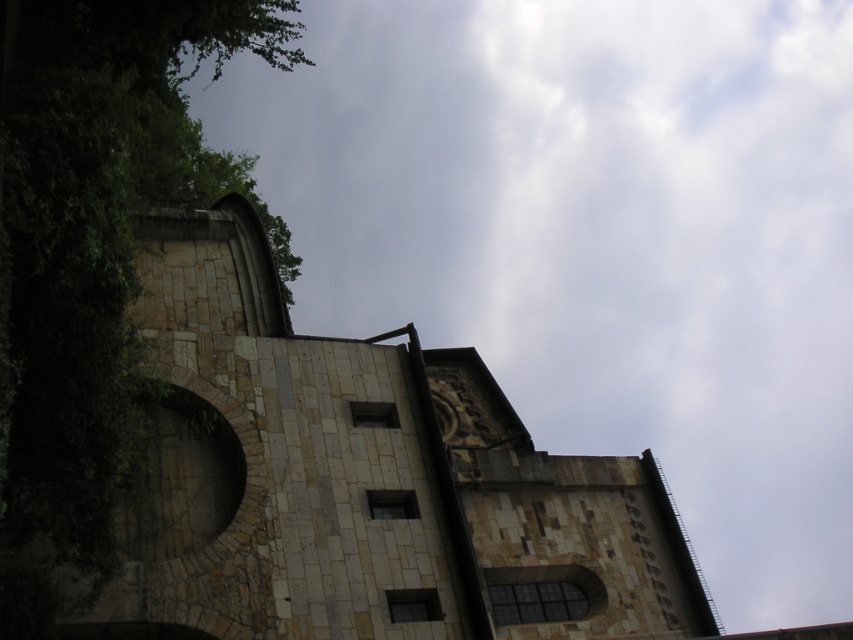
Identify the location of stone church at center. (358, 483).

Is point (343, 589) farther from viewer compared to point (68, 234)?

That is True.

Measure the distance between stone church at center and camera.

A distance of 102.33 feet exists between stone church at center and camera.

I want to click on stone church at center, so click(x=358, y=483).